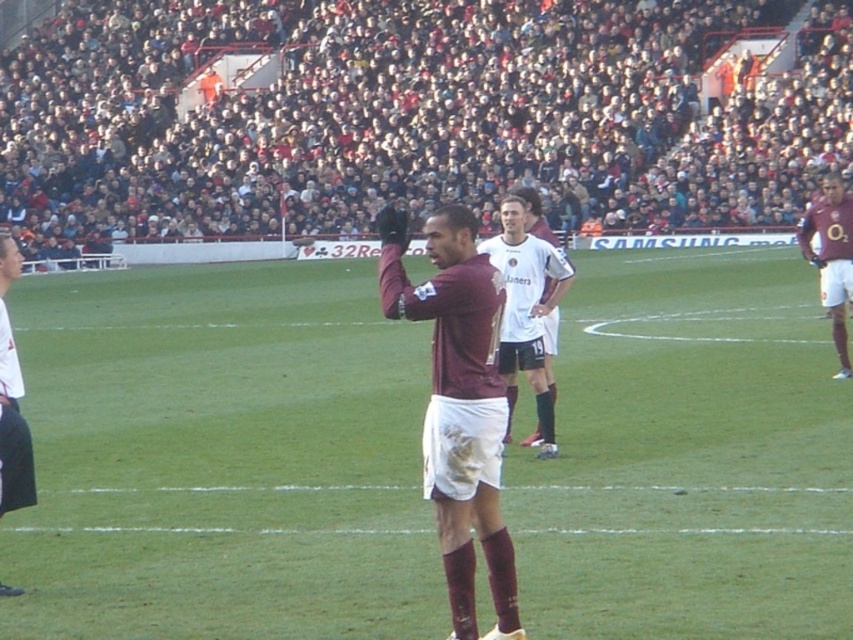
Which is below, white jersey at center or maroon jersey at center?

Positioned lower is white jersey at center.

Which is behind, point (566, 268) or point (848, 296)?

Positioned behind is point (848, 296).

Find the location of a particular element. white jersey at center is located at coordinates (526, 310).

Is point (456, 483) closer to camera compared to point (16, 266)?

Yes, it is in front of point (16, 266).

Can you confirm if burgundy jersey at center is smaller than white jersey at left?

No.

Between point (433, 426) and point (35, 493), which one is positioned in front?

Point (433, 426) is more forward.

Where is `burgundy jersey at center`? The width and height of the screenshot is (853, 640). burgundy jersey at center is located at coordinates (457, 404).

Does burgundy jersey at center appear on the right side of maroon jersey at center?

In fact, burgundy jersey at center is to the left of maroon jersey at center.

Can you confirm if burgundy jersey at center is positioned to the left of maroon jersey at center?

Yes, burgundy jersey at center is to the left of maroon jersey at center.

Which is behind, point (480, 260) or point (824, 209)?

Positioned behind is point (824, 209).

Where is `burgundy jersey at center`? Image resolution: width=853 pixels, height=640 pixels. burgundy jersey at center is located at coordinates [x=457, y=404].